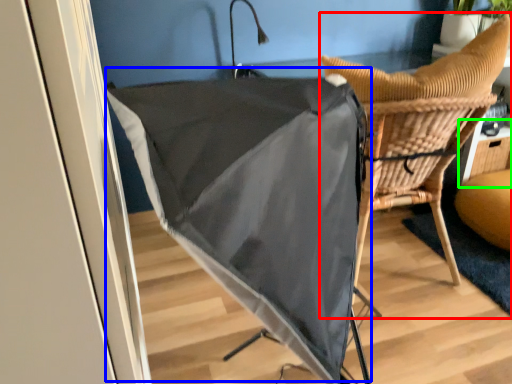
Question: Considering the real-world distances, which object is farthest from chair (highlighted by a red box)? umbrella (highlighted by a blue box) or table (highlighted by a green box)?

Choices:
 (A) umbrella
 (B) table

Answer: (B)